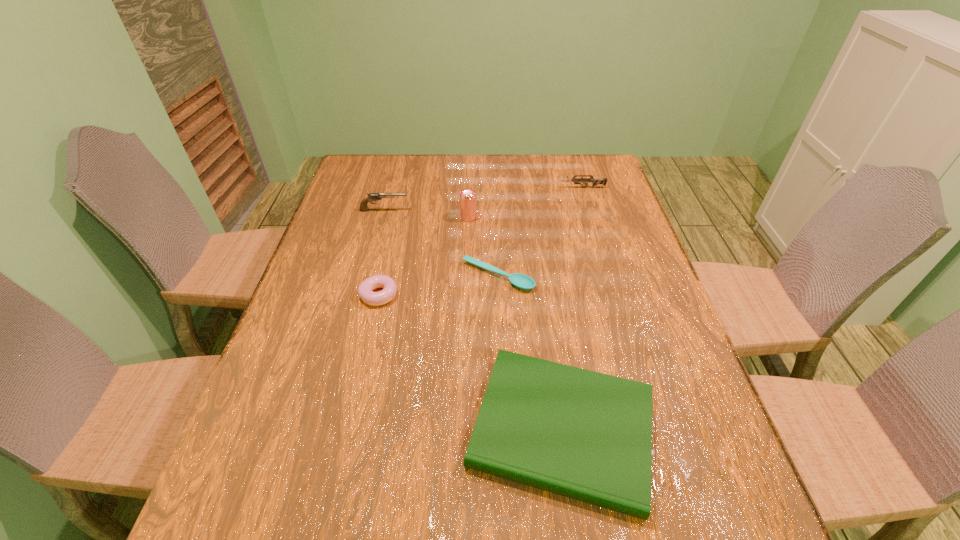
At what (x,y) coordinates should I click in order to perform the action: click on vacant space located aiming along the barrel of the second farthest object. Please return your answer as a coordinate pair (x, y). The image size is (960, 540). Looking at the image, I should click on (434, 211).

Find the location of a particular element. This screenshot has width=960, height=540. vacant position located aimed along the barrel of the farthest object is located at coordinates (524, 188).

The image size is (960, 540). In order to click on free spot located aimed along the barrel of the farthest object in this screenshot , I will do `click(473, 188)`.

Locate an element on the screen. Image resolution: width=960 pixels, height=540 pixels. free spot located aimed along the barrel of the farthest object is located at coordinates (479, 188).

At what (x,y) coordinates should I click in order to perform the action: click on vacant region located 0.350m on the front of the doughnut. Please return your answer as a coordinate pair (x, y). This screenshot has width=960, height=540. Looking at the image, I should click on (345, 445).

This screenshot has height=540, width=960. I want to click on free space located on the left of the paperback book, so click(x=368, y=430).

Identify the location of free space located 0.380m on the left of the spoon. This screenshot has width=960, height=540. (320, 276).

Locate an element on the screen. object present at the far edge is located at coordinates (595, 181).

This screenshot has width=960, height=540. Find the location of `object situated at the near edge`. object situated at the near edge is located at coordinates (585, 435).

Image resolution: width=960 pixels, height=540 pixels. I want to click on gun at the left edge, so click(371, 197).